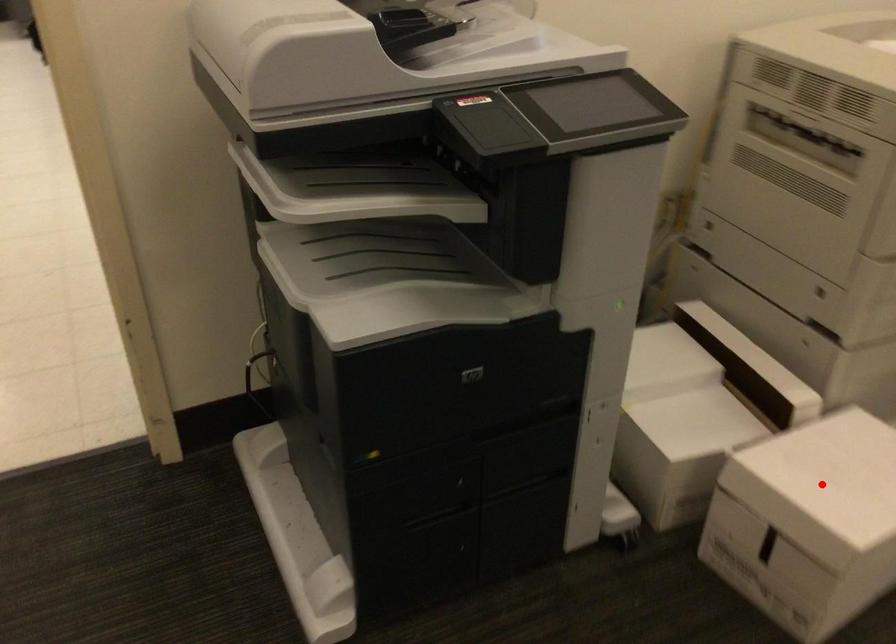
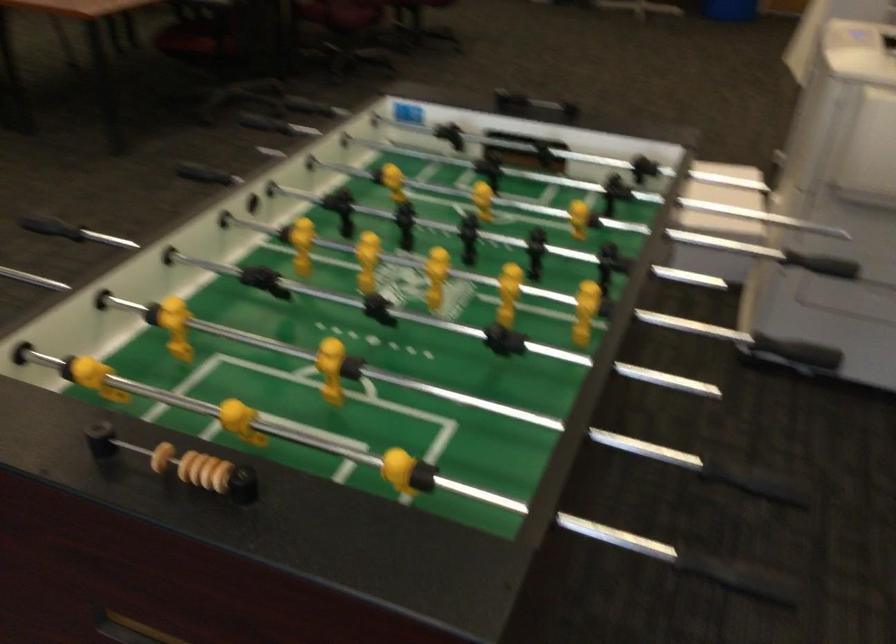
Question: I am providing you with two images of the same scene from different viewpoints. A red point is marked on the first image. At the location where the point appears in image 1, is it still visible in image 2?

Choices:
 (A) Yes
 (B) No

Answer: (B)